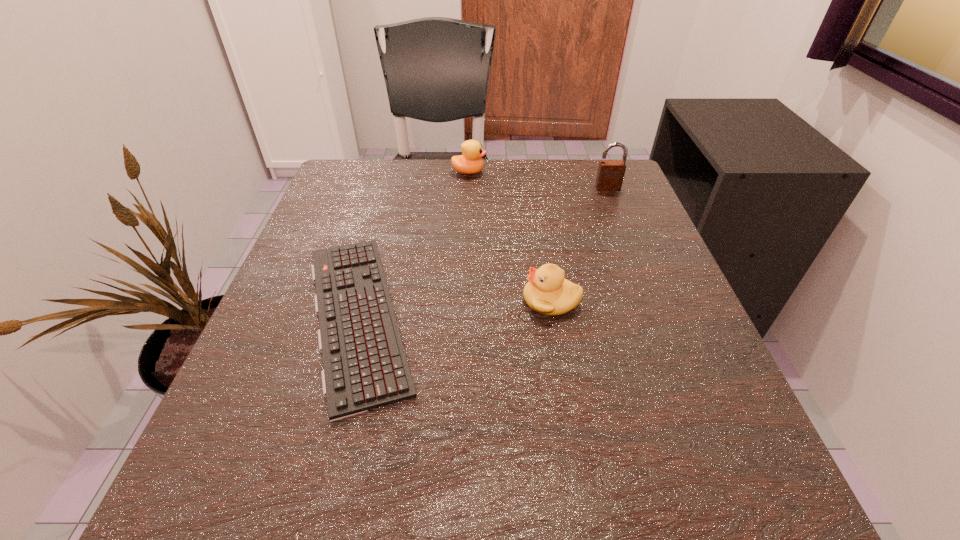
The width and height of the screenshot is (960, 540). Identify the location of vacant area at the near edge. (359, 516).

The height and width of the screenshot is (540, 960). I want to click on blank space at the left edge, so click(x=299, y=272).

Locate an element on the screen. blank space at the right edge is located at coordinates (632, 303).

The height and width of the screenshot is (540, 960). I want to click on blank space at the far left corner of the desktop, so click(x=350, y=187).

The height and width of the screenshot is (540, 960). I want to click on free space at the far right corner of the desktop, so click(571, 181).

Identify the location of unoccupied position between the farther duckling and the padlock. (539, 180).

At what (x,y) coordinates should I click in order to perform the action: click on empty space that is in between the third object from left to right and the shortest object. Please return your answer as a coordinate pair (x, y). The image size is (960, 540). Looking at the image, I should click on click(x=454, y=307).

At what (x,y) coordinates should I click in order to perform the action: click on vacant region between the tallest object and the third object from left to right. Please return your answer as a coordinate pair (x, y). This screenshot has width=960, height=540. Looking at the image, I should click on (580, 244).

This screenshot has width=960, height=540. What are the coordinates of `free space between the farthest object and the leftmost object` in the screenshot? It's located at (413, 244).

Locate an element on the screen. The height and width of the screenshot is (540, 960). unoccupied position between the shortest object and the left duckling is located at coordinates (413, 244).